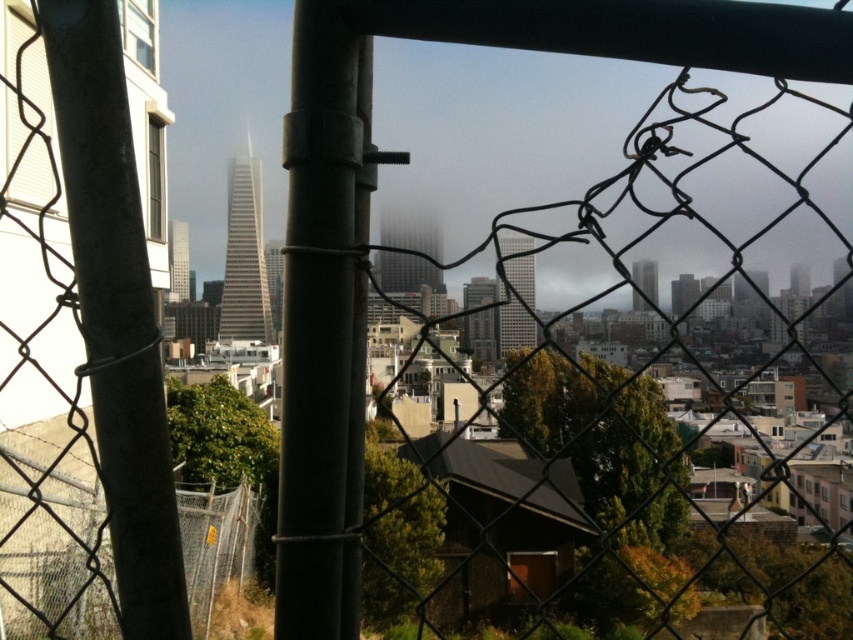
Does matte black pole at center appear on the right side of metallic chain-link fence at lower left?

Indeed, matte black pole at center is positioned on the right side of metallic chain-link fence at lower left.

Who is shorter, matte black pole at center or metallic chain-link fence at lower left?

With less height is metallic chain-link fence at lower left.

Does point (287, 384) come behind point (206, 570)?

No, (287, 384) is closer to viewer.

Locate an element on the screen. The width and height of the screenshot is (853, 640). matte black pole at center is located at coordinates (323, 324).

Is metallic pole at left smaller than metallic chain-link fence at lower left?

Correct, metallic pole at left occupies less space than metallic chain-link fence at lower left.

In order to click on metallic pole at left in this screenshot , I will do `click(115, 312)`.

Is matte black pole at center positioned before metallic pole at left?

No, it is not.

Can you confirm if matte black pole at center is smaller than metallic pole at left?

Yes.

Image resolution: width=853 pixels, height=640 pixels. I want to click on matte black pole at center, so click(323, 324).

The height and width of the screenshot is (640, 853). I want to click on matte black pole at center, so click(323, 324).